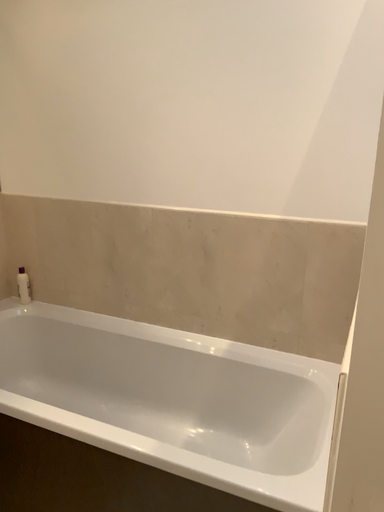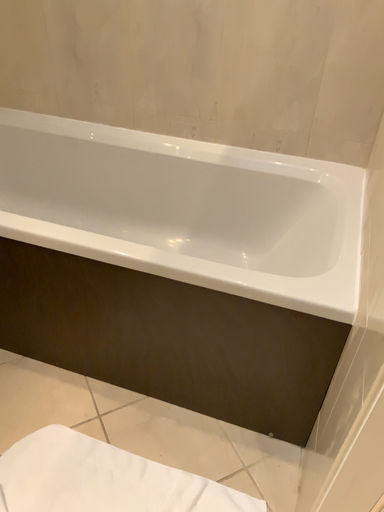
Question: Which way did the camera rotate in the video?

Choices:
 (A) rotated upward
 (B) rotated downward

Answer: (B)